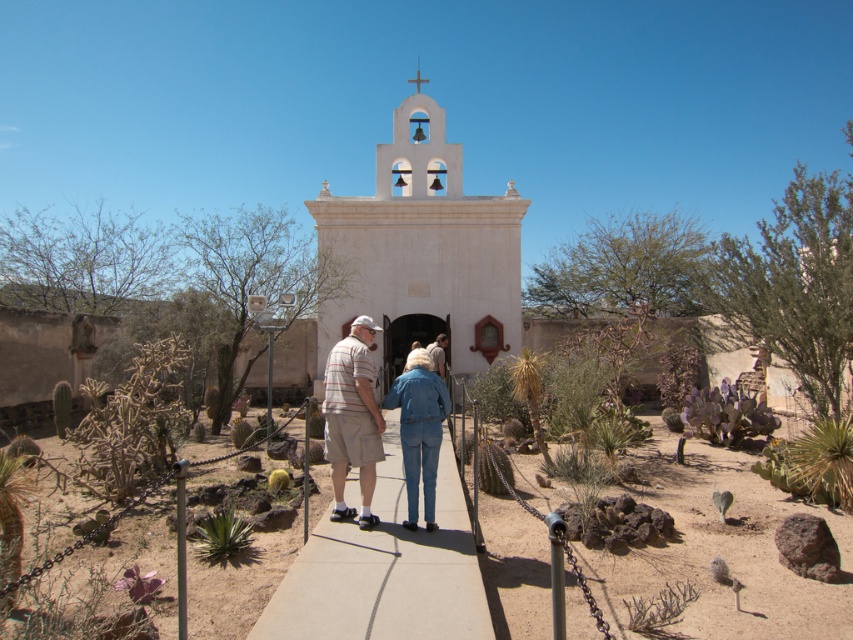
Question: Can you confirm if denim jacket at center is positioned above denim jeans at center?

Choices:
 (A) yes
 (B) no

Answer: (B)

Question: Which object is positioned closest to the denim jeans at center?

Choices:
 (A) white stucco chapel at center
 (B) concrete sidewalk at center

Answer: (B)

Question: Does concrete sidewalk at center appear on the right side of denim jacket at center?

Choices:
 (A) yes
 (B) no

Answer: (A)

Question: Based on their relative distances, which object is farther from the striped cotton shirt at center?

Choices:
 (A) light brown leather jacket at center
 (B) concrete sidewalk at center
 (C) denim jacket at center

Answer: (A)

Question: Is striped cotton shirt at center above denim jeans at center?

Choices:
 (A) yes
 (B) no

Answer: (A)

Question: Which object appears farthest from the camera in this image?

Choices:
 (A) striped cotton shirt at center
 (B) white stucco chapel at center
 (C) denim jeans at center
 (D) light brown leather jacket at center

Answer: (D)